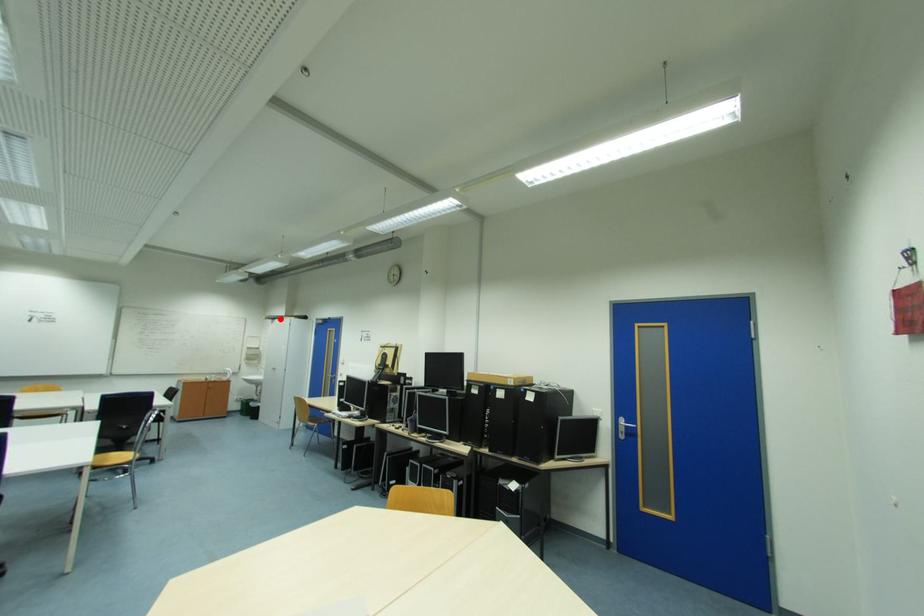
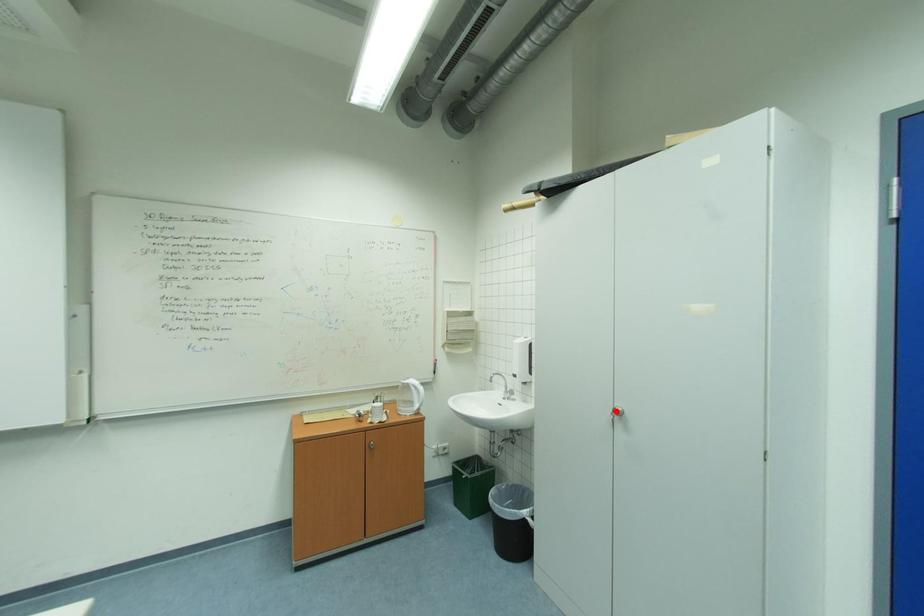
I am providing you with two images of the same scene from different viewpoints. A red point is marked on the first image and another point is marked on the second image. Do the highlighted points in image1 and image2 indicate the same real-world spot?

No